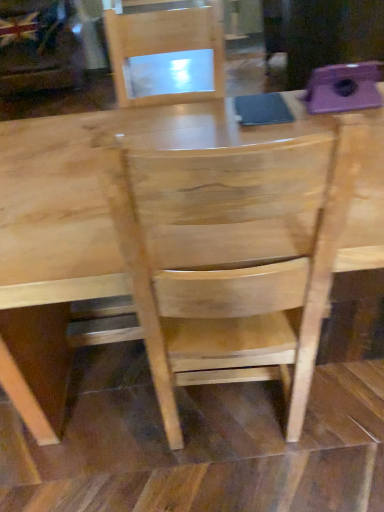
Question: Should I look upward or downward to see natural wood chair at center?

Choices:
 (A) up
 (B) down

Answer: (B)